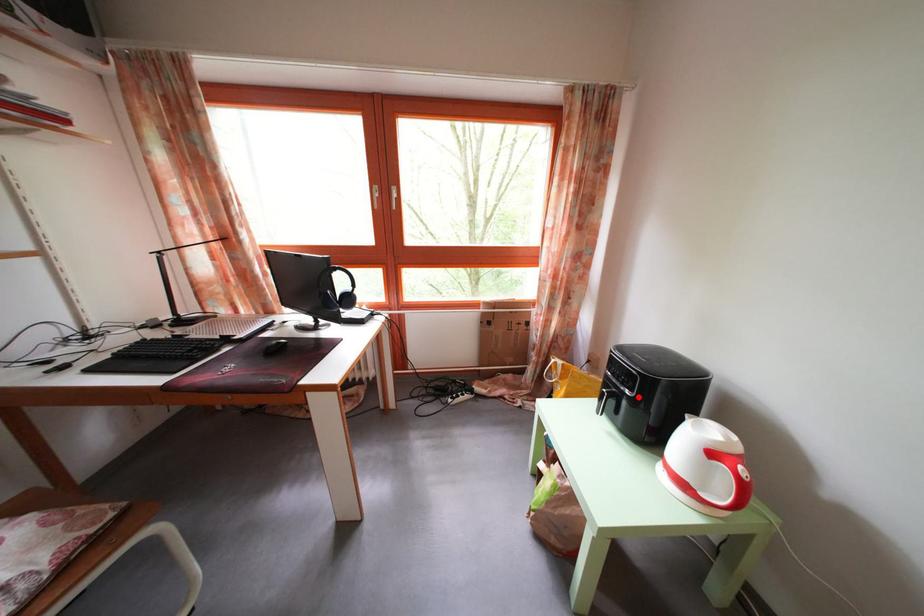
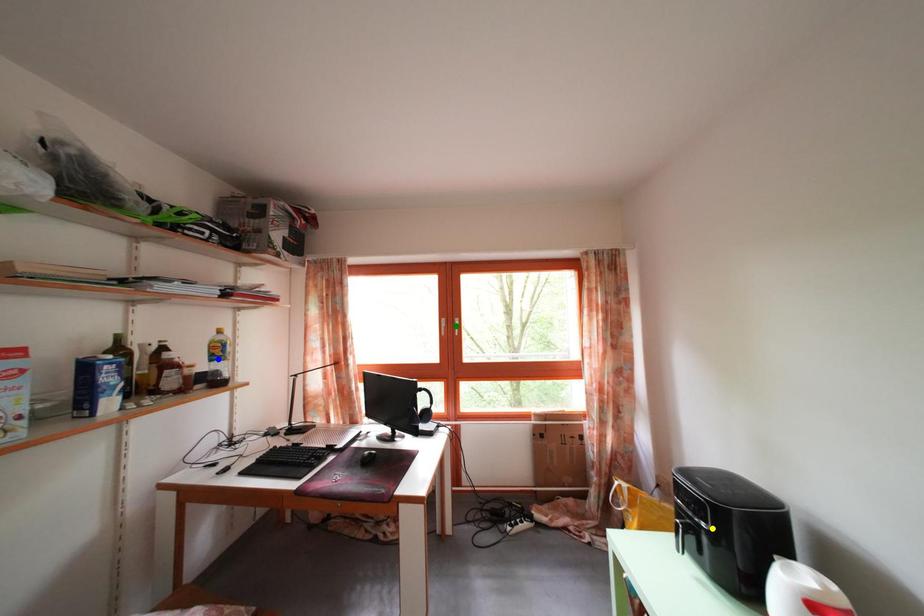
Question: I am providing you with two images of the same scene from different viewpoints. A red point is marked on the first image. You are given multiple points on the second image. Which point in image 2 is actually the same real-world point as the red point in image 1?

Choices:
 (A) green point
 (B) yellow point
 (C) blue point

Answer: (B)